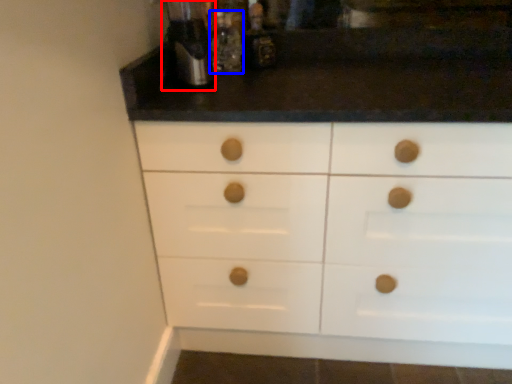
Question: Which object is further to the camera taking this photo, coffee machine (highlighted by a red box) or bottle (highlighted by a blue box)?

Choices:
 (A) coffee machine
 (B) bottle

Answer: (B)